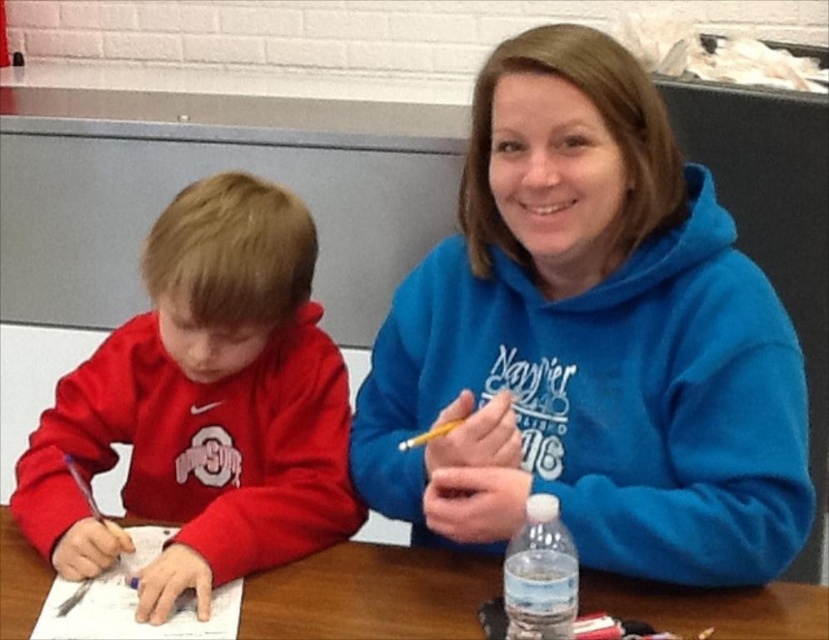
Question: Which point appears farthest from the camera in this image?

Choices:
 (A) (258, 310)
 (B) (508, 401)

Answer: (A)

Question: Does matte red sweatshirt at left appear on the right side of wooden table at center?

Choices:
 (A) no
 (B) yes

Answer: (A)

Question: Among these objects, which one is farthest from the camera?

Choices:
 (A) wooden table at center
 (B) matte red sweatshirt at left

Answer: (B)

Question: Is wooden table at center bigger than clear plastic bottle at lower center?

Choices:
 (A) yes
 (B) no

Answer: (A)

Question: Does blue fleece hoodie at upper right have a larger size compared to clear plastic bottle at lower center?

Choices:
 (A) no
 (B) yes

Answer: (B)

Question: Which object is the closest to the clear plastic bottle at lower center?

Choices:
 (A) wooden table at center
 (B) matte red sweatshirt at left
 (C) blue fleece hoodie at upper right

Answer: (A)